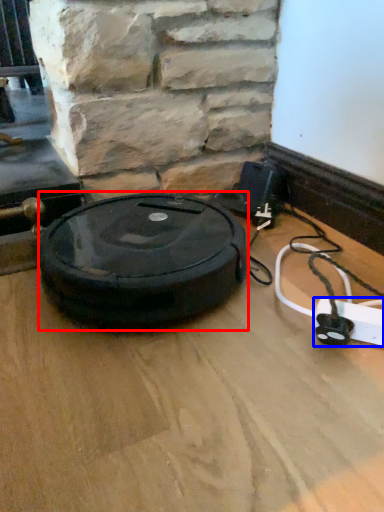
Question: Which object appears closest to the camera in this image, car tire (highlighted by a red box) or extension cord (highlighted by a blue box)?

Choices:
 (A) car tire
 (B) extension cord

Answer: (B)